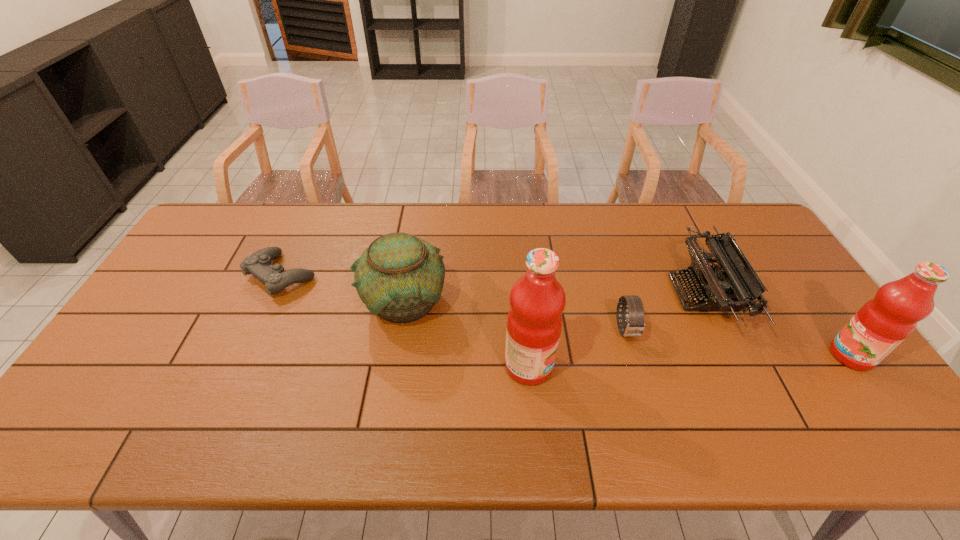
The width and height of the screenshot is (960, 540). Identify the location of the left fruit juice. (537, 300).

The height and width of the screenshot is (540, 960). I want to click on the taller fruit juice, so click(x=537, y=300).

Locate an element on the screen. the fifth shortest object is located at coordinates (881, 324).

Where is `the right fruit juice`? the right fruit juice is located at coordinates (881, 324).

Where is `control`? Image resolution: width=960 pixels, height=540 pixels. control is located at coordinates (275, 279).

At what (x,y) coordinates should I click in order to perform the action: click on the shortest object. Please return your answer as a coordinate pair (x, y). Looking at the image, I should click on (275, 279).

Locate an element on the screen. The height and width of the screenshot is (540, 960). the fifth tallest object is located at coordinates (634, 327).

Locate an element on the screen. This screenshot has width=960, height=540. watch is located at coordinates (634, 327).

This screenshot has height=540, width=960. What are the coordinates of `pottery` in the screenshot? It's located at (399, 277).

The width and height of the screenshot is (960, 540). Identify the location of the third tallest object. (399, 277).